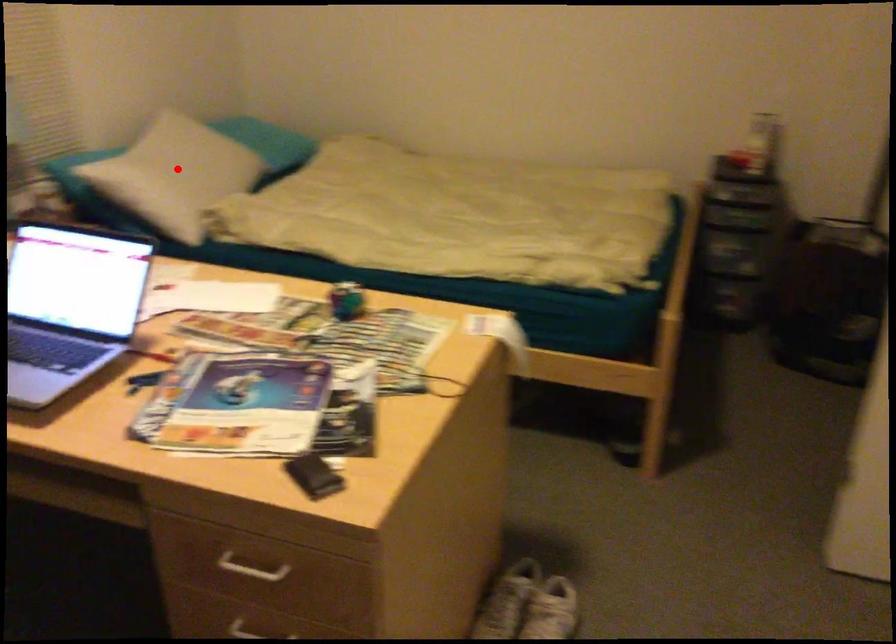
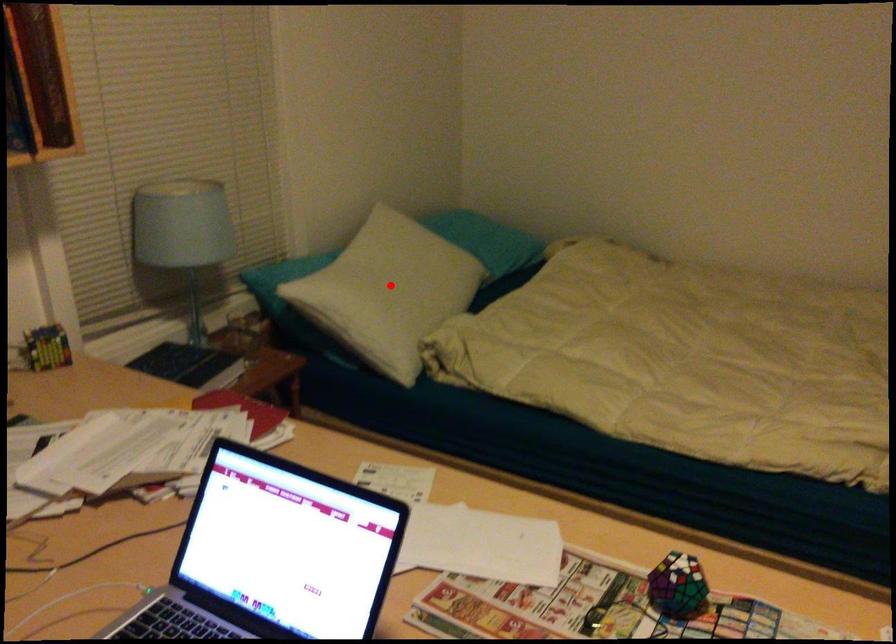
I am providing you with two images of the same scene from different viewpoints. A red point is marked on the first image and another point is marked on the second image. Does the point marked in image1 correspond to the same location as the one in image2?

Yes